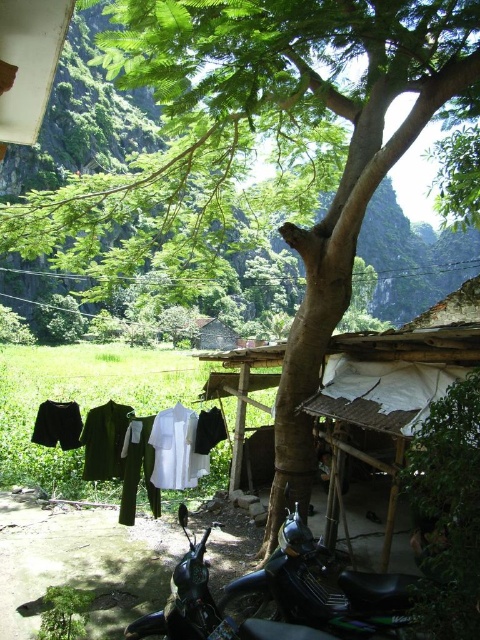
Question: Does green matte motorcycle at lower center lie in front of white cotton shirt at center?

Choices:
 (A) no
 (B) yes

Answer: (B)

Question: In this image, where is green matte motorcycle at lower center located relative to white cotton shirt at center?

Choices:
 (A) left
 (B) right

Answer: (B)

Question: Is green matte motorcycle at lower center closer to the viewer compared to white cotton shirt at center?

Choices:
 (A) no
 (B) yes

Answer: (B)

Question: Which point is closer to the camera?

Choices:
 (A) white cotton shirt at center
 (B) green matte motorcycle at lower center

Answer: (B)

Question: Which point appears farthest from the camera in this image?

Choices:
 (A) (297, 621)
 (B) (180, 408)

Answer: (B)